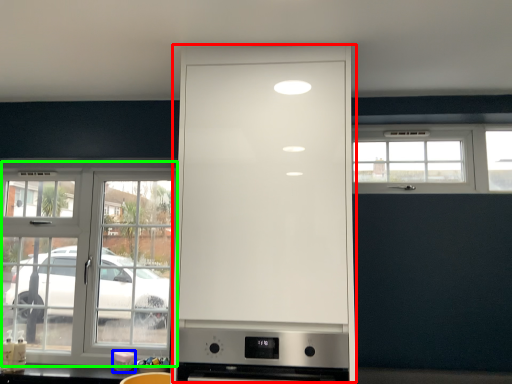
Question: Which object is positioned farthest from cabinetry (highlighted by a red box)? Select from appliance (highlighted by a blue box) and window (highlighted by a green box).

Choices:
 (A) appliance
 (B) window

Answer: (A)